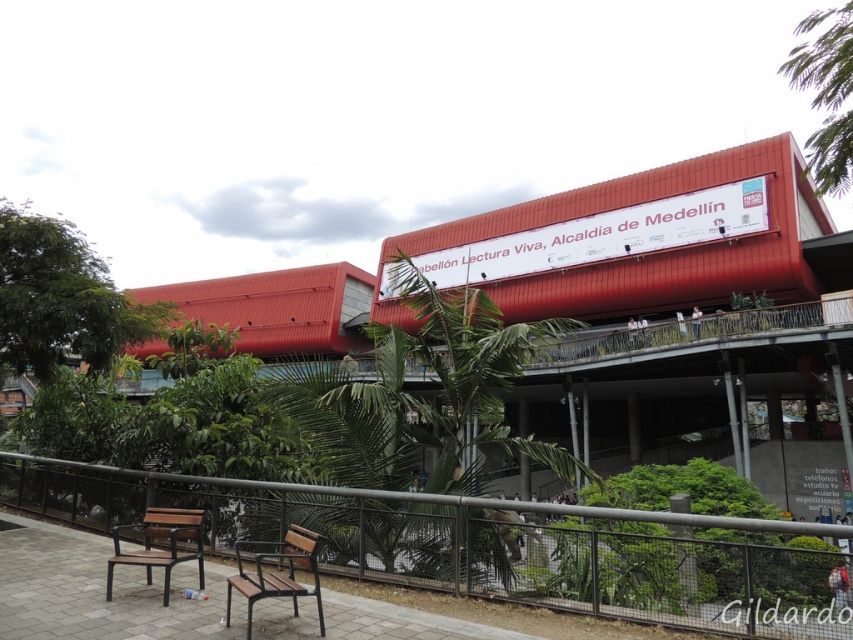
Consider the image. You are a city planner assessing the seating capacity of the area. Given that the brown wooden bench at lower center and the brown wooden bench at lower left are both available, which bench can accommodate more people?

The brown wooden bench at lower center can accommodate more people because it has a larger size compared to the brown wooden bench at lower left.

You are a person standing at the entrance of the large red building with a modern architectural design. You want to sit down to rest. Is the brown wooden bench at lower center within your immediate reach without walking too far?

The brown wooden bench at lower center is 4.33 meters from viewer, so yes, it is within immediate reach as 4.33 meters is a short distance for someone to walk to sit down.